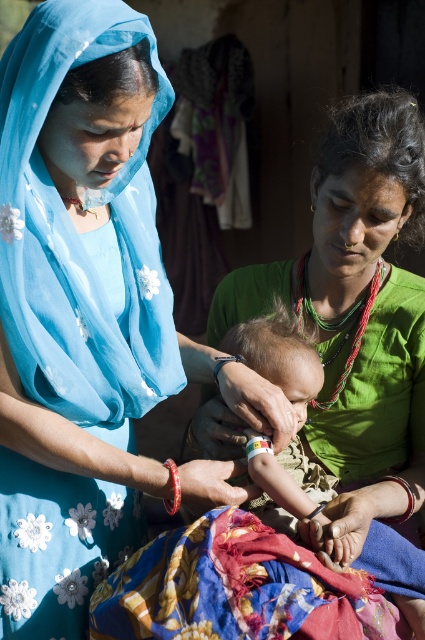
Question: Which of the following is the farthest from the observer?

Choices:
 (A) (300, 273)
 (B) (124, 593)

Answer: (A)

Question: Is blue fabric headscarf at upper left to the left of green fabric at center from the viewer's perspective?

Choices:
 (A) yes
 (B) no

Answer: (A)

Question: Which object is positioned closest to the multicolored fabric at lower center?

Choices:
 (A) blue fabric headscarf at upper left
 (B) green fabric at center

Answer: (B)

Question: Estimate the real-world distances between objects in this image. Which object is farther from the multicolored fabric at lower center?

Choices:
 (A) blue fabric headscarf at upper left
 (B) green fabric at center

Answer: (A)

Question: From the image, what is the correct spatial relationship of blue fabric headscarf at upper left in relation to multicolored fabric at lower center?

Choices:
 (A) right
 (B) left

Answer: (B)

Question: Can you confirm if blue fabric headscarf at upper left is positioned above green fabric at center?

Choices:
 (A) no
 (B) yes

Answer: (A)